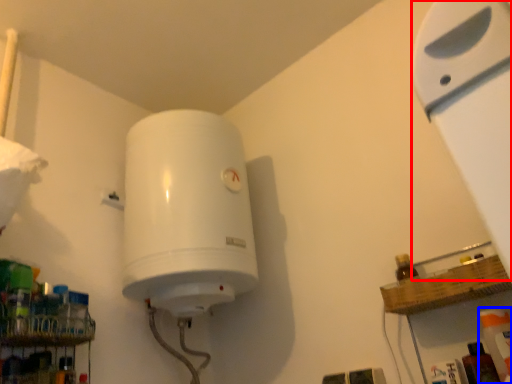
Question: Which of the following is the closest to the observer, wide (highlighted by a red box) or cleaning product (highlighted by a blue box)?

Choices:
 (A) wide
 (B) cleaning product

Answer: (A)